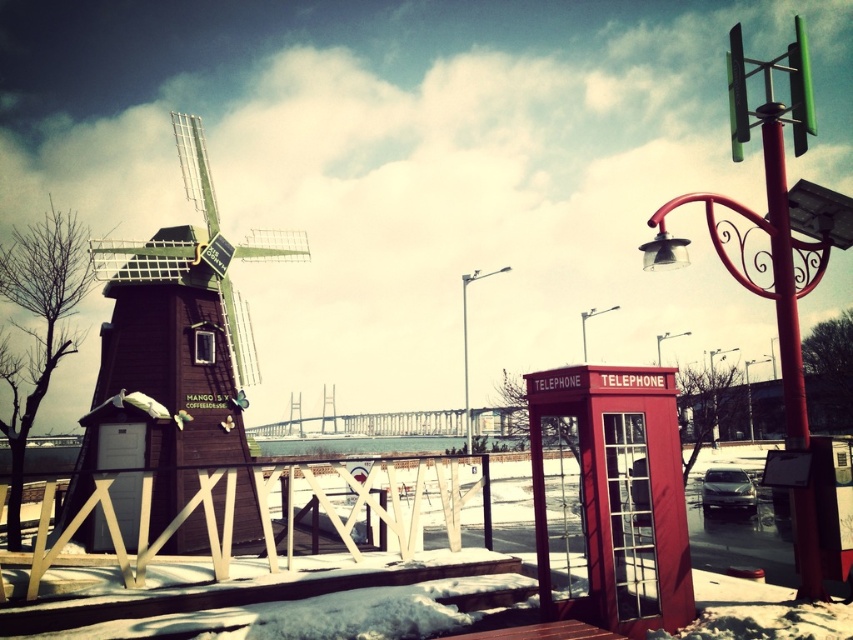
You are standing in the winter scene and want to take a photo of the matte red telephone booth at right and the red metallic pole at upper right. Which object is closer to the ground?

The matte red telephone booth at right is closer to the ground than the red metallic pole at upper right because it is positioned below it.

You are standing at the center of the image. Which object is located at the coordinates point (613,497)?

The matte red telephone booth at right is located at point (613,497).